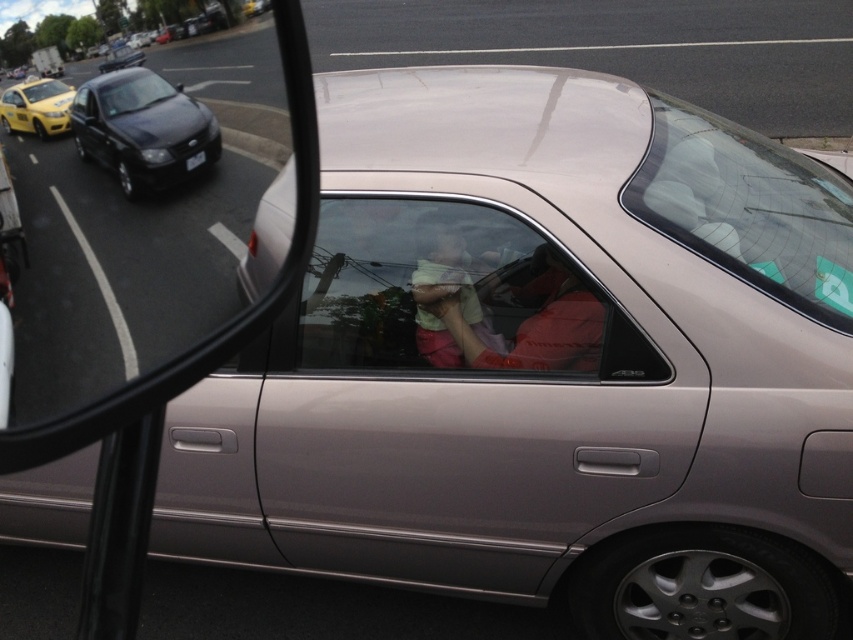
Question: Is clear glass mirror at center below yellow matte taxi at upper left?

Choices:
 (A) no
 (B) yes

Answer: (B)

Question: Does light green fabric at center appear under black plastic license plate at center?

Choices:
 (A) no
 (B) yes

Answer: (B)

Question: Which object is the farthest from the light green fabric at center?

Choices:
 (A) shiny black sedan at left
 (B) clear glass windshield at upper center
 (C) clear glass window at center
 (D) yellow matte taxi at upper left

Answer: (D)

Question: Among these points, which one is farthest from the camera?

Choices:
 (A) (186, 168)
 (B) (740, 241)

Answer: (B)

Question: Can you confirm if clear glass mirror at center is positioned to the right of matte green shirt at center?

Choices:
 (A) yes
 (B) no

Answer: (B)

Question: Which object is farther from the camera taking this photo?

Choices:
 (A) black plastic license plate at center
 (B) yellow matte taxi at upper left
 (C) light green fabric at center
 (D) shiny black sedan at left

Answer: (C)